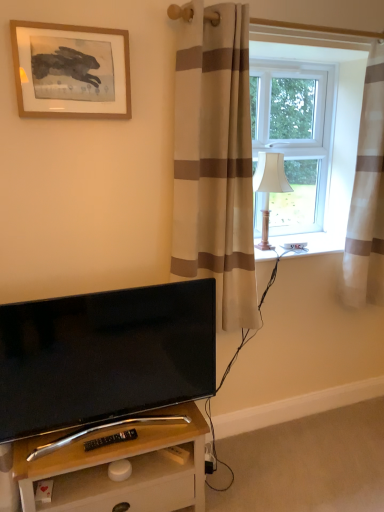
Question: Is white fabric lampshade at right surrounded by black glossy tv at lower left?

Choices:
 (A) yes
 (B) no

Answer: (B)

Question: Considering the relative sizes of black glossy tv at lower left and white fabric lampshade at right in the image provided, is black glossy tv at lower left shorter than white fabric lampshade at right?

Choices:
 (A) yes
 (B) no

Answer: (B)

Question: Is black glossy tv at lower left facing away from white fabric lampshade at right?

Choices:
 (A) yes
 (B) no

Answer: (B)

Question: Does black glossy tv at lower left lie behind white fabric lampshade at right?

Choices:
 (A) no
 (B) yes

Answer: (A)

Question: From the image's perspective, does black glossy tv at lower left appear higher than white fabric lampshade at right?

Choices:
 (A) yes
 (B) no

Answer: (B)

Question: Choose the correct answer: Is beige striped curtain at center, positioned as the second curtain in right-to-left order, inside black glossy tv at lower left or outside it?

Choices:
 (A) inside
 (B) outside

Answer: (B)

Question: Looking at the image, does beige striped curtain at center, placed as the 1th curtain when sorted from left to right, seem bigger or smaller compared to black glossy tv at lower left?

Choices:
 (A) small
 (B) big

Answer: (B)

Question: Considering the positions of beige striped curtain at center, placed as the 1th curtain when sorted from left to right, and black glossy tv at lower left in the image, is beige striped curtain at center, placed as the 1th curtain when sorted from left to right, wider or thinner than black glossy tv at lower left?

Choices:
 (A) wide
 (B) thin

Answer: (A)

Question: From a real-world perspective, is beige striped curtain at center, placed as the 1th curtain when sorted from left to right, physically located above or below black glossy tv at lower left?

Choices:
 (A) below
 (B) above

Answer: (B)

Question: Relative to wooden frame at upper left, is beige striped curtain at center, positioned as the second curtain in right-to-left order, in front or behind?

Choices:
 (A) front
 (B) behind

Answer: (A)

Question: Considering the positions of point (228, 39) and point (114, 55), is point (228, 39) closer or farther from the camera than point (114, 55)?

Choices:
 (A) farther
 (B) closer

Answer: (A)

Question: Do you think beige striped curtain at center, positioned as the second curtain in right-to-left order, is within wooden frame at upper left, or outside of it?

Choices:
 (A) outside
 (B) inside

Answer: (A)

Question: From a real-world perspective, relative to wooden frame at upper left, is beige striped curtain at center, placed as the 1th curtain when sorted from left to right, vertically above or below?

Choices:
 (A) below
 (B) above

Answer: (A)

Question: From a real-world perspective, is white fabric lampshade at right physically located above or below wooden frame at upper left?

Choices:
 (A) above
 (B) below

Answer: (B)

Question: Is white fabric lampshade at right inside or outside of wooden frame at upper left?

Choices:
 (A) outside
 (B) inside

Answer: (A)